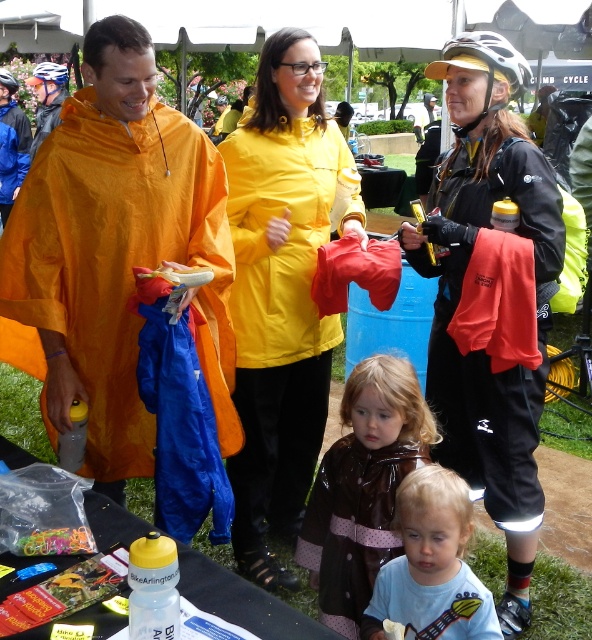
Question: Which point is closer to the camera?

Choices:
 (A) black matte jacket at right
 (B) orange waterproof poncho at left
 (C) blue cotton shirt at lower center
 (D) brown shiny raincoat at center

Answer: (C)

Question: Is orange waterproof poncho at left further to the viewer compared to black matte jacket at right?

Choices:
 (A) no
 (B) yes

Answer: (A)

Question: Which point is farther to the camera?

Choices:
 (A) orange waterproof poncho at left
 (B) black matte jacket at right

Answer: (B)

Question: Which object is closer to the camera taking this photo?

Choices:
 (A) yellow waterproof jacket at center
 (B) orange waterproof poncho at left
 (C) blue cotton shirt at lower center

Answer: (C)

Question: Can you confirm if black matte jacket at right is thinner than yellow waterproof jacket at center?

Choices:
 (A) yes
 (B) no

Answer: (A)

Question: In this image, where is orange waterproof poncho at left located relative to black matte jacket at right?

Choices:
 (A) right
 (B) left

Answer: (B)